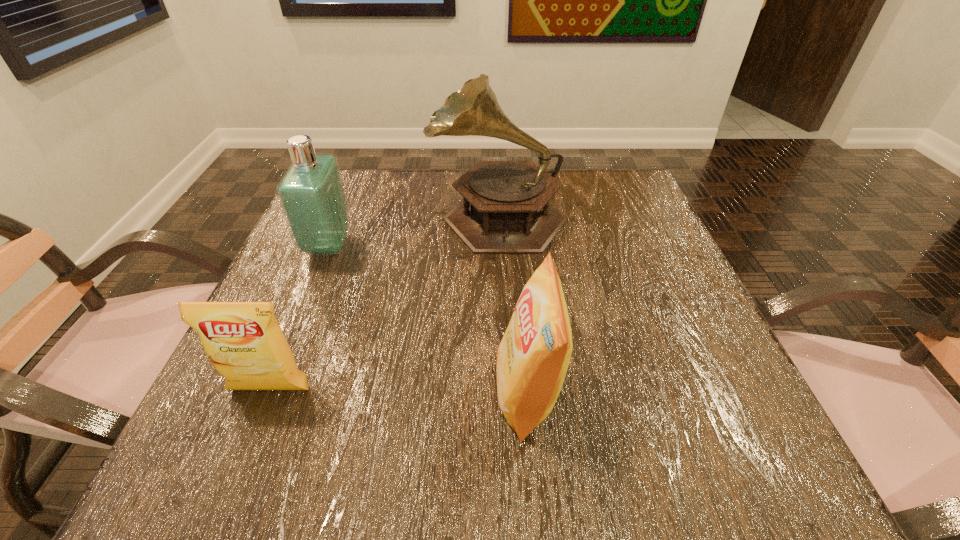
Locate an element on the screen. free space that is in between the right crisp (potato chip) and the perfume is located at coordinates (428, 320).

In order to click on free space between the tallest object and the perfume in this screenshot , I will do `click(413, 231)`.

The width and height of the screenshot is (960, 540). Find the location of `blank region between the phonograph record and the right crisp (potato chip)`. blank region between the phonograph record and the right crisp (potato chip) is located at coordinates (513, 305).

At what (x,y) coordinates should I click in order to perform the action: click on the second closest object to the left crisp (potato chip). Please return your answer as a coordinate pair (x, y). The image size is (960, 540). Looking at the image, I should click on [533, 356].

What are the coordinates of `object that stands as the third closest to the perfume` in the screenshot? It's located at (533, 356).

This screenshot has width=960, height=540. Find the location of `vacant space that satisfies the following two spatial constraints: 1. on the horn direction of the phonograph record; 2. on the front of the left crisp (potato chip) with the logo`. vacant space that satisfies the following two spatial constraints: 1. on the horn direction of the phonograph record; 2. on the front of the left crisp (potato chip) with the logo is located at coordinates (507, 390).

Locate an element on the screen. free location that satisfies the following two spatial constraints: 1. on the horn direction of the phonograph record; 2. on the front of the left crisp (potato chip) with the logo is located at coordinates (507, 390).